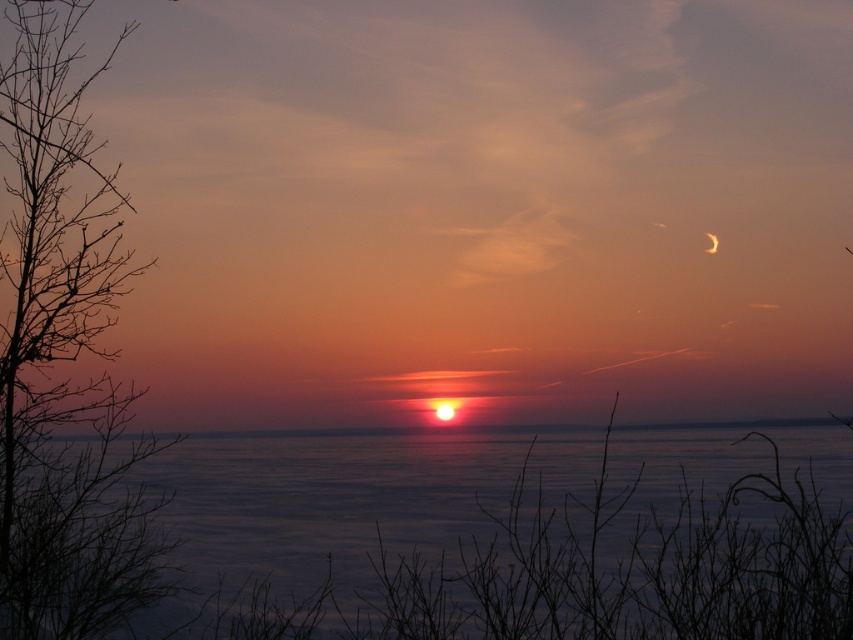
Question: Does silhouette branch at left lie in front of silvery metallic crescent at upper right?

Choices:
 (A) yes
 (B) no

Answer: (A)

Question: Among these objects, which one is farthest from the camera?

Choices:
 (A) silvery metallic crescent at upper right
 (B) blue water at center
 (C) silhouette branch at left

Answer: (A)

Question: Estimate the real-world distances between objects in this image. Which object is farther from the blue water at center?

Choices:
 (A) silhouette branch at left
 (B) silvery metallic crescent at upper right

Answer: (B)

Question: Can you confirm if silhouette branch at left is positioned to the left of silvery metallic crescent at upper right?

Choices:
 (A) no
 (B) yes

Answer: (B)

Question: Observing the image, what is the correct spatial positioning of blue water at center in reference to silhouette branch at left?

Choices:
 (A) below
 (B) above

Answer: (A)

Question: Which object appears farthest from the camera in this image?

Choices:
 (A) silvery metallic crescent at upper right
 (B) blue water at center
 (C) silhouette branch at left

Answer: (A)